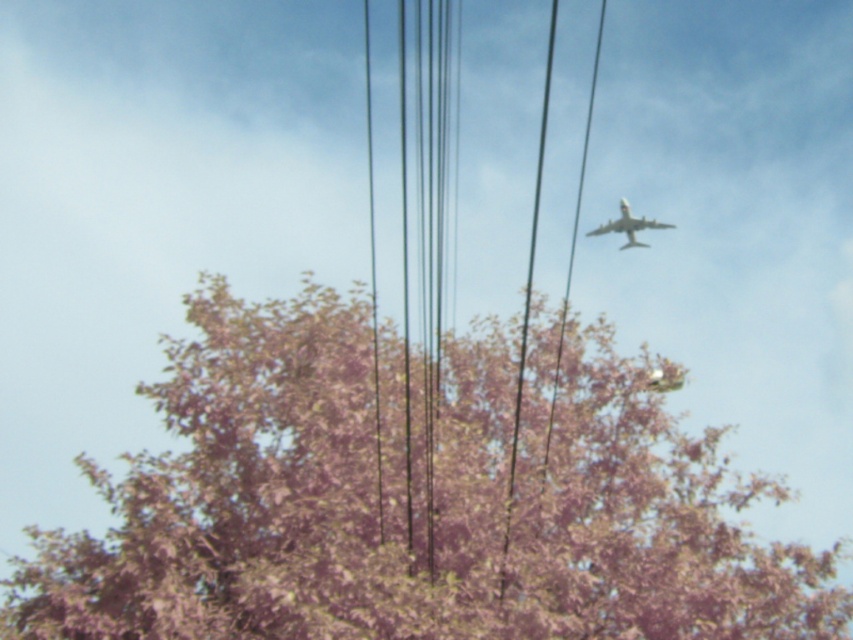
Between pink leafy tree at upper center and white matte airplane at upper right, which one appears on the right side from the viewer's perspective?

Positioned to the right is white matte airplane at upper right.

Does pink leafy tree at upper center appear under white matte airplane at upper right?

Indeed, pink leafy tree at upper center is positioned under white matte airplane at upper right.

Is point (498, 358) more distant than point (590, 236)?

No.

Where is `pink leafy tree at upper center`? This screenshot has width=853, height=640. pink leafy tree at upper center is located at coordinates (401, 502).